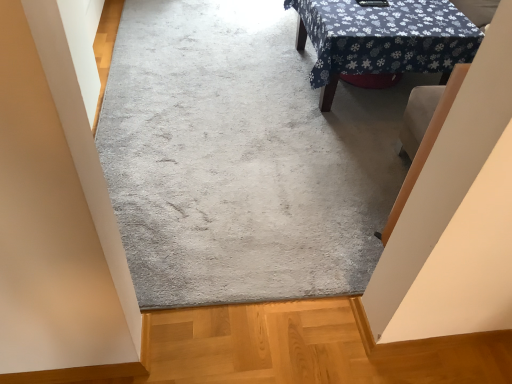
What do you see at coordinates (383, 39) in the screenshot?
I see `blue floral tablecloth at upper center` at bounding box center [383, 39].

Where is `blue floral tablecloth at upper center`? The width and height of the screenshot is (512, 384). blue floral tablecloth at upper center is located at coordinates (383, 39).

What is the approximate width of blue floral tablecloth at upper center?

blue floral tablecloth at upper center is 3.59 feet wide.

Where is `blue floral tablecloth at upper center`? The height and width of the screenshot is (384, 512). blue floral tablecloth at upper center is located at coordinates (383, 39).